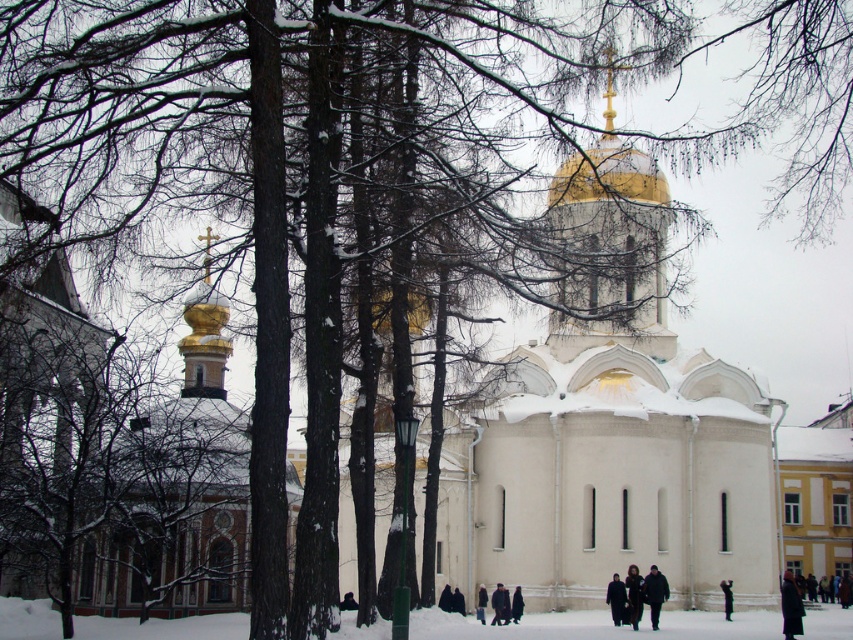
Measure the distance between black fur coat at lower center and dark wool coat at center.

black fur coat at lower center and dark wool coat at center are 5.14 feet apart.

Which is behind, point (637, 576) or point (612, 586)?

The point (612, 586) is more distant.

Find the location of `black fur coat at lower center`. black fur coat at lower center is located at coordinates [634, 595].

Between point (618, 576) and point (495, 600), which one is positioned behind?

The point (495, 600) is more distant.

Between dark wool coat at center and dark brown coat at lower center, which one has less height?

dark brown coat at lower center is shorter.

Does point (618, 576) lie in front of point (506, 621)?

No, it is not.

The height and width of the screenshot is (640, 853). Identify the location of dark wool coat at center. (616, 600).

Is point (650, 602) positioned behind point (730, 580)?

No, (650, 602) is in front of (730, 580).

Between dark gray fabric coat at lower center and black fabric person at lower right, which one has less height?

With less height is dark gray fabric coat at lower center.

Is point (651, 564) positioned after point (728, 595)?

That is False.

At what (x,y) coordinates should I click in order to perform the action: click on dark gray fabric coat at lower center. Please return your answer as a coordinate pair (x, y). Looking at the image, I should click on (654, 593).